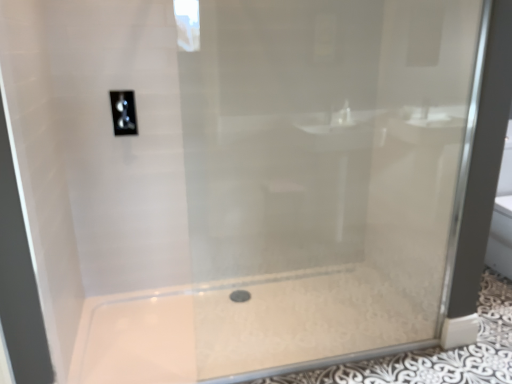
Question: Considering the positions of point (112, 96) and point (339, 286), is point (112, 96) closer or farther from the camera than point (339, 286)?

Choices:
 (A) farther
 (B) closer

Answer: (B)

Question: Is satin nickel toggle at upper center spatially inside white glossy bath at center, or outside of it?

Choices:
 (A) outside
 (B) inside

Answer: (A)

Question: Looking at the image, does satin nickel toggle at upper center seem bigger or smaller compared to white glossy bath at center?

Choices:
 (A) small
 (B) big

Answer: (A)

Question: In the image, is white glossy bath at center positioned in front of or behind satin nickel toggle at upper center?

Choices:
 (A) behind
 (B) front

Answer: (B)

Question: From a real-world perspective, is white glossy bath at center physically located above or below satin nickel toggle at upper center?

Choices:
 (A) below
 (B) above

Answer: (A)

Question: Is white glossy bath at center inside the boundaries of satin nickel toggle at upper center, or outside?

Choices:
 (A) inside
 (B) outside

Answer: (B)

Question: From the image's perspective, relative to satin nickel toggle at upper center, is white glossy bath at center above or below?

Choices:
 (A) above
 (B) below

Answer: (B)